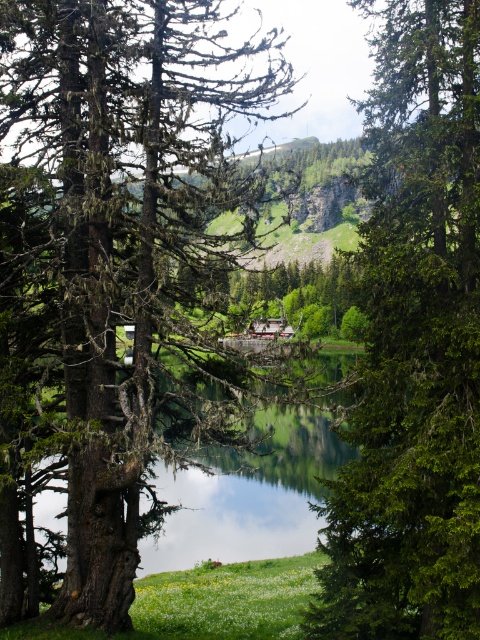
Does green mossy tree at left have a larger size compared to green glossy tree at center?

Yes.

Which is in front, point (46, 109) or point (328, 589)?

Point (328, 589)

Describe the element at coordinates (116, 266) in the screenshot. I see `green mossy tree at left` at that location.

Locate an element on the screen. Image resolution: width=480 pixels, height=640 pixels. green mossy tree at left is located at coordinates (116, 266).

Is green mossy tree at left smaller than green grassy field at lower center?

No.

Does point (52, 156) come farther from viewer compared to point (180, 600)?

No, (52, 156) is closer to viewer.

Is point (103, 515) farther from camera compared to point (231, 588)?

No, (103, 515) is closer to viewer.

You are a GUI agent. You are given a task and a screenshot of the screen. Output one action in this format:
    pyautogui.click(x=<x>, y=<y>)
    Task: Click on the green mossy tree at left
    The height and width of the screenshot is (640, 480).
    Given the screenshot: What is the action you would take?
    pyautogui.click(x=116, y=266)

Describe the element at coordinates (414, 346) in the screenshot. I see `green glossy tree at center` at that location.

Is green glossy tree at center below green grassy field at lower center?

Incorrect, green glossy tree at center is not positioned below green grassy field at lower center.

Who is more distant from viewer, (x=389, y=90) or (x=190, y=621)?

Positioned behind is point (x=190, y=621).

Locate an element on the screen. Image resolution: width=480 pixels, height=640 pixels. green glossy tree at center is located at coordinates (414, 346).